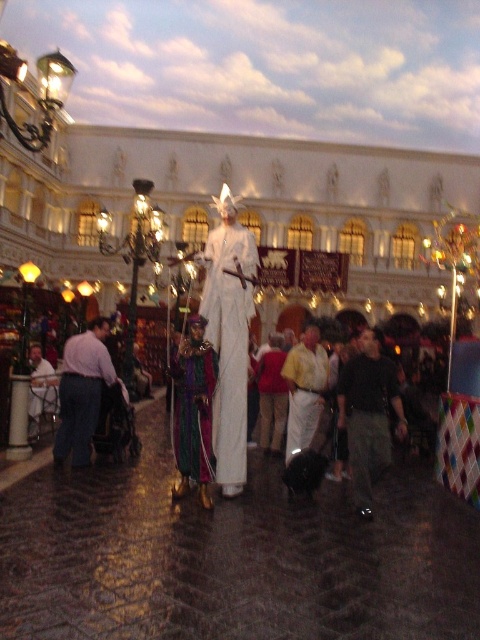
In the scene shown: You are a photographer trying to capture a clear photo of both the white fabric statue at center and the white cotton shirt at center. Since both are white, you need to adjust your camera settings to ensure proper exposure. Which object should you focus on first to avoid overexposure?

The white fabric statue at center is above the white cotton shirt at center, so focusing on the white cotton shirt at center first would help avoid overexposure as it is closer to the camera.

You are standing at the center of the scene and want to reach both the white fabric statue at center and the white cotton shirt at center. Which object is closer to you?

Both the white fabric statue at center and the white cotton shirt at center are at the same distance from you since they are both at the center of the scene.

You are a costume designer looking at the image and need to determine the placement of the black cotton pants at center and the multicolored velvet robe at center for a performance. Which item is positioned lower on the performer?

The black cotton pants at center is located below multicolored velvet robe at center, so the black cotton pants at center is positioned lower on the performer.